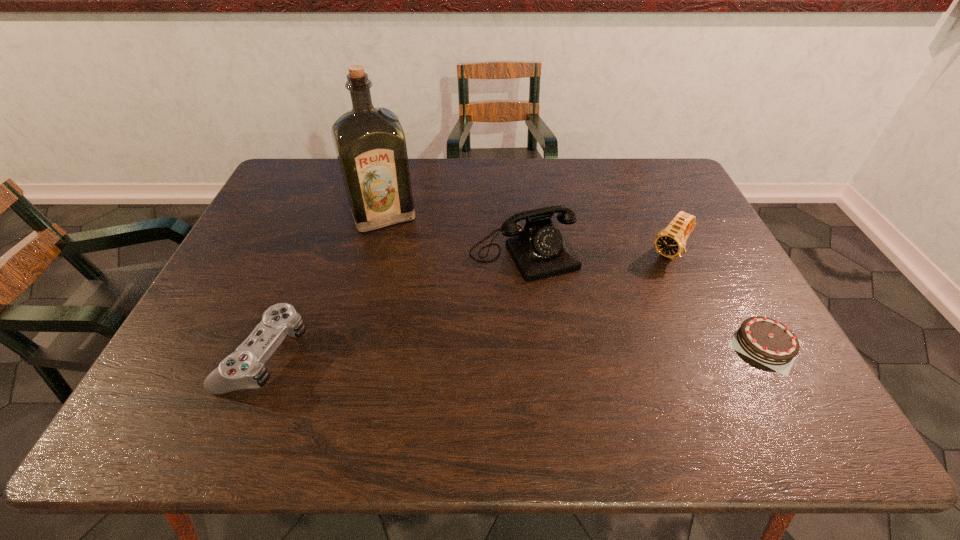
I want to click on free space between the liquor and the chocolate cake, so click(x=574, y=279).

Find the location of `free space between the tallest object and the telephone`. free space between the tallest object and the telephone is located at coordinates (453, 234).

Image resolution: width=960 pixels, height=540 pixels. I want to click on vacant space in between the chocolate cake and the telephone, so click(x=644, y=299).

Where is `free space between the shortest object and the tallest object`? The image size is (960, 540). free space between the shortest object and the tallest object is located at coordinates (574, 279).

The width and height of the screenshot is (960, 540). What are the coordinates of `free spot between the chocolate cake and the tallest object` in the screenshot? It's located at (574, 279).

The width and height of the screenshot is (960, 540). In order to click on vacant space that's between the third object from right to left and the liquor in this screenshot , I will do `click(453, 234)`.

You are a GUI agent. You are given a task and a screenshot of the screen. Output one action in this format:
    pyautogui.click(x=<x>, y=<y>)
    Task: Click on the vacant space that is in between the third object from right to left and the fourth tallest object
    The width and height of the screenshot is (960, 540).
    Given the screenshot: What is the action you would take?
    pyautogui.click(x=395, y=304)

Find the location of a particular element. The height and width of the screenshot is (540, 960). free space between the chocolate cake and the telephone is located at coordinates (644, 299).

Find the location of a particular element. object that ranks as the third closest to the tallest object is located at coordinates (670, 242).

Identify the location of object that is the closest to the third object from left to right. The width and height of the screenshot is (960, 540). (370, 144).